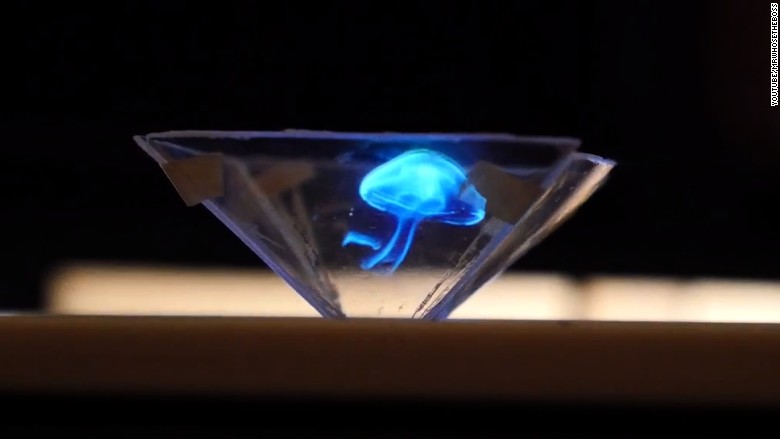
Find the location of `table`. table is located at coordinates (441, 370).